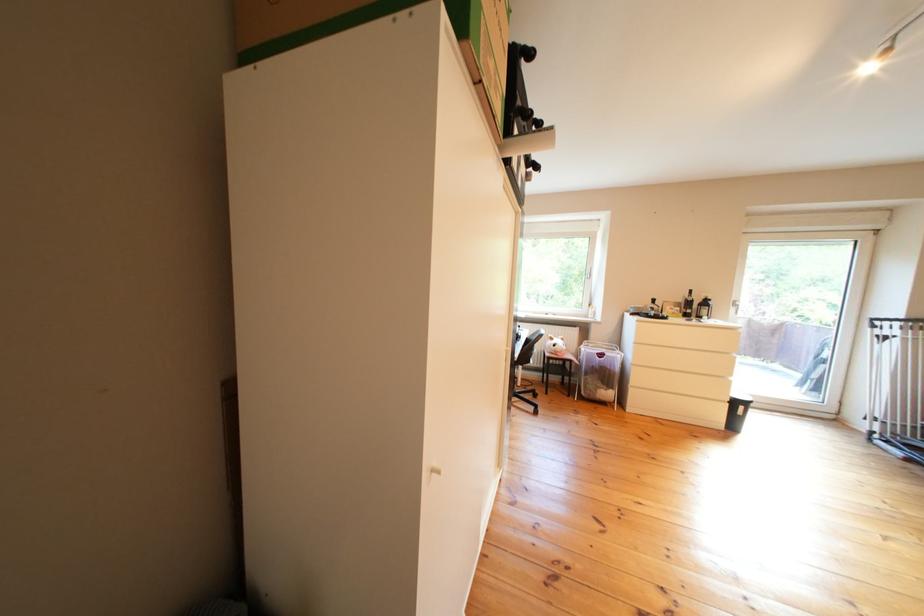
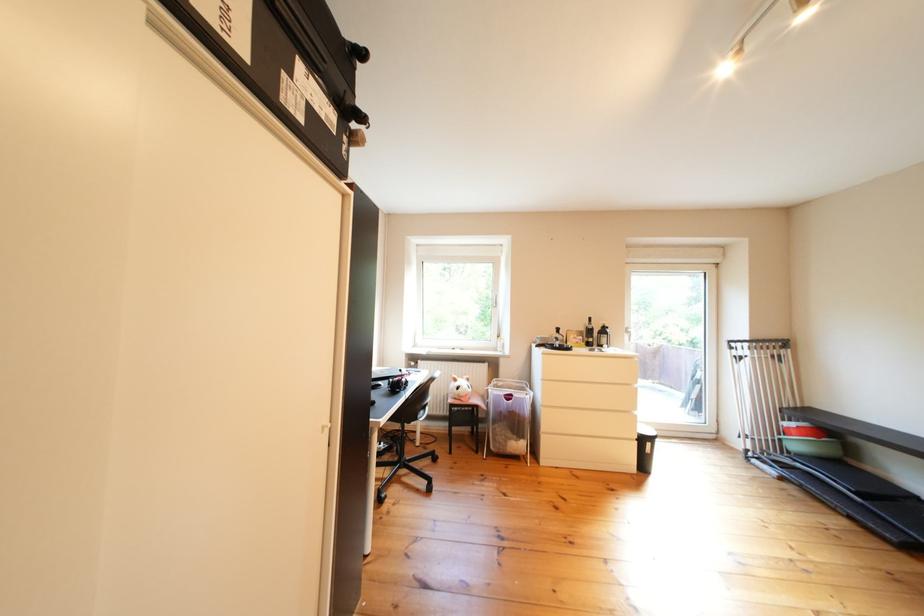
What movement of the cameraman would produce the second image?

The cameraman walked toward right, forward.